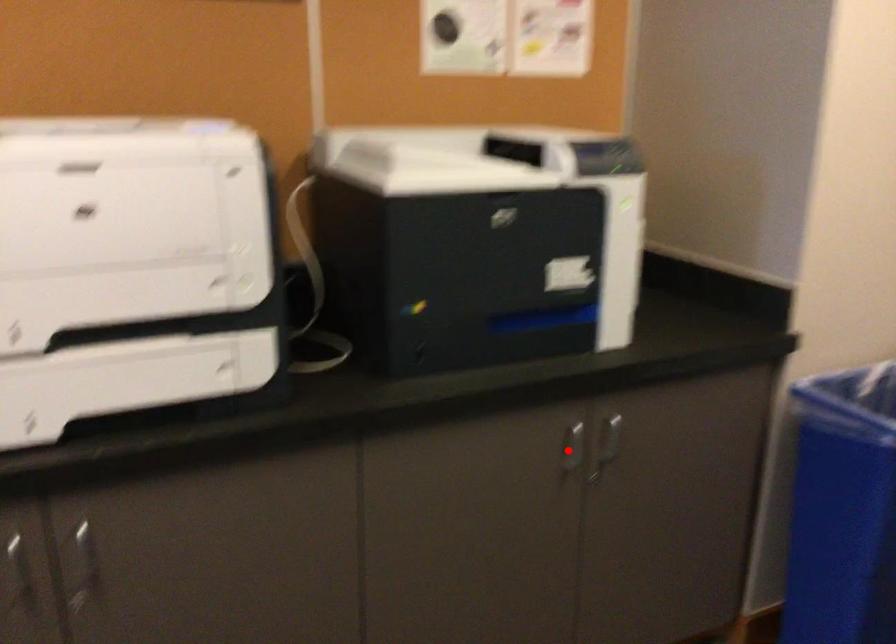
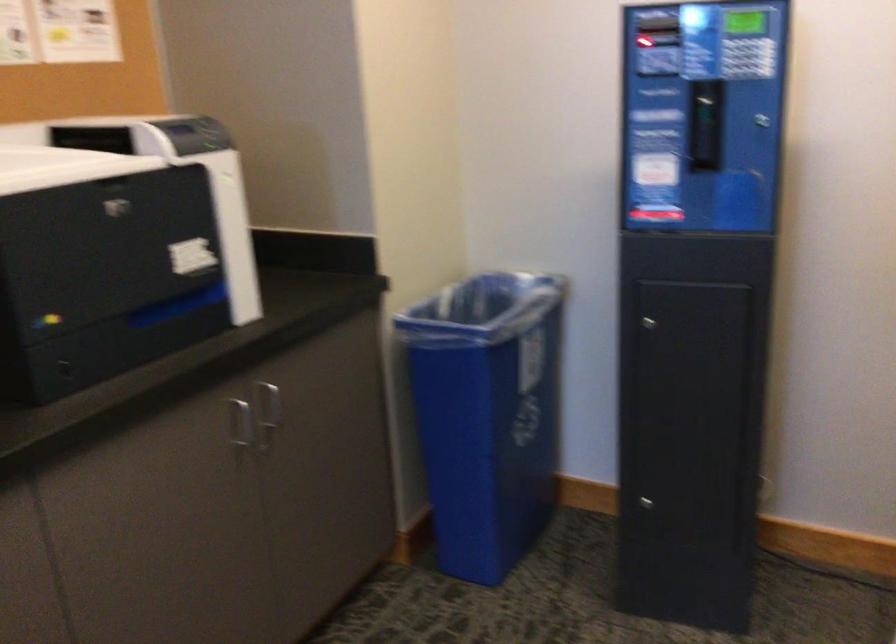
The point at the highlighted location is marked in the first image. Where is the corresponding point in the second image?

(239, 424)